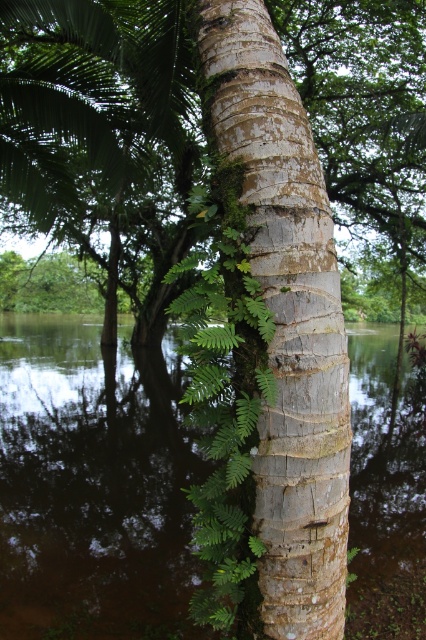
Question: Which of the following is the farthest from the observer?

Choices:
 (A) [x=152, y=12]
 (B) [x=181, y=308]

Answer: (A)

Question: Where is smooth bark tree trunk at center located in relation to green leafy fern at center in the image?

Choices:
 (A) left
 (B) right

Answer: (B)

Question: Which is nearer to the brown reflective water at center?

Choices:
 (A) green textured bark at center
 (B) green leafy fern at center
 (C) smooth bark tree trunk at center

Answer: (A)

Question: Is green textured bark at center below green leafy fern at center?

Choices:
 (A) yes
 (B) no

Answer: (B)

Question: Can you confirm if green textured bark at center is positioned to the left of brown reflective water at center?

Choices:
 (A) no
 (B) yes

Answer: (A)

Question: Which is farther from the smooth bark tree trunk at center?

Choices:
 (A) brown reflective water at center
 (B) green leafy fern at center

Answer: (A)